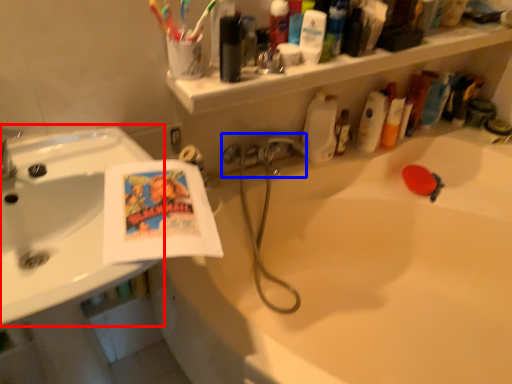
Question: Which object appears closest to the camera in this image, sink (highlighted by a red box) or plumbing fixture (highlighted by a blue box)?

Choices:
 (A) sink
 (B) plumbing fixture

Answer: (A)